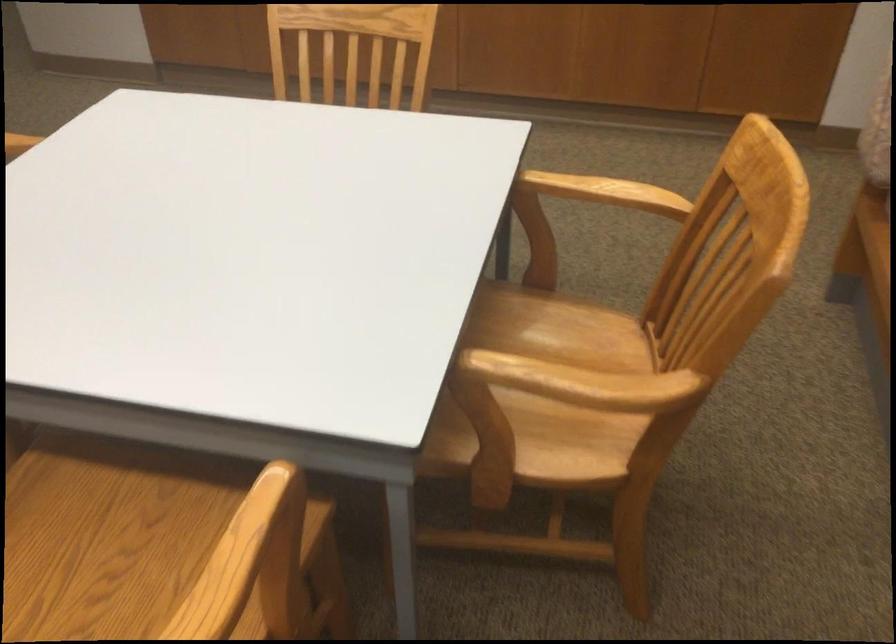
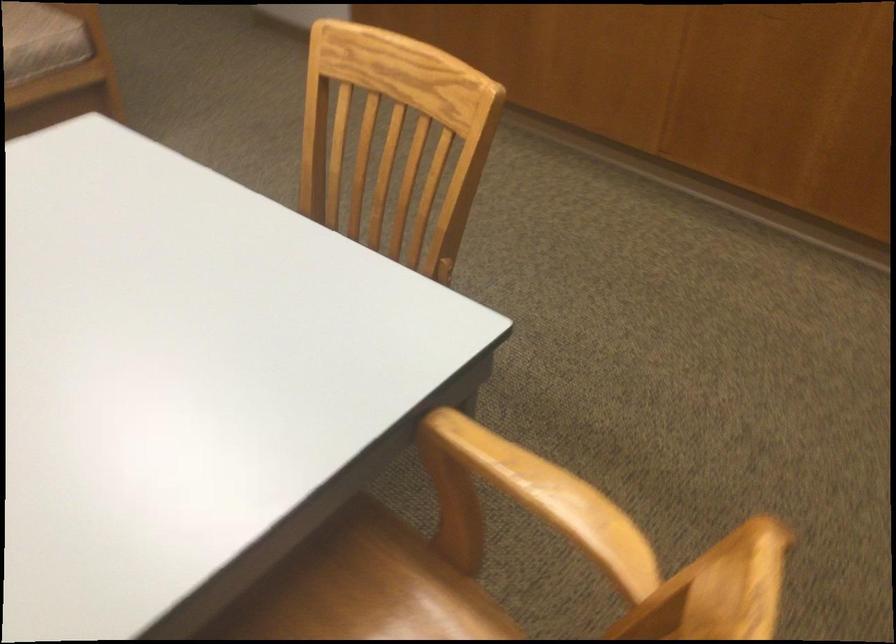
Question: How did the camera likely rotate?

Choices:
 (A) Left
 (B) Right
 (C) Up
 (D) Down

Answer: (A)